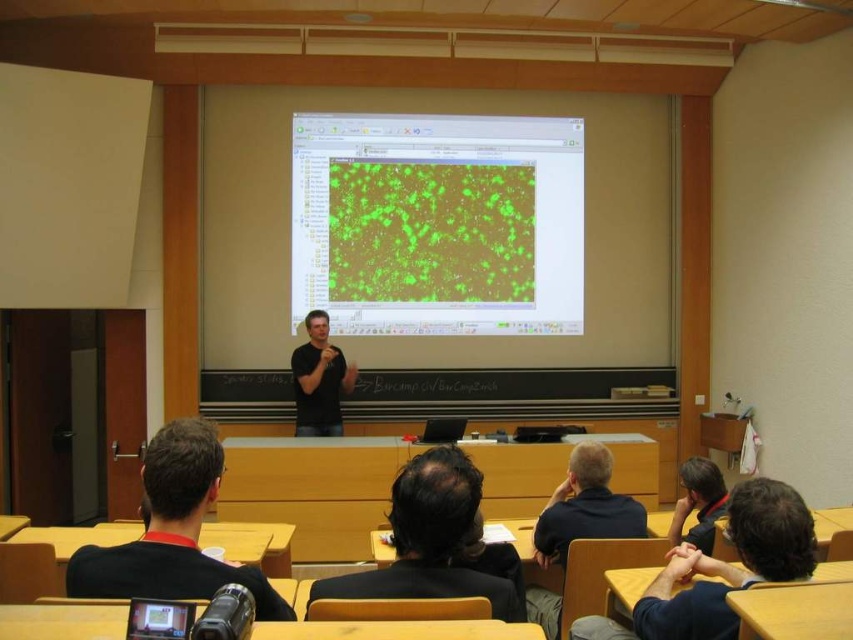
Who is positioned more to the right, black fabric shirt at lower left or black matte shirt at center?

black fabric shirt at lower left

The image size is (853, 640). Describe the element at coordinates (172, 531) in the screenshot. I see `black fabric shirt at lower left` at that location.

You are a GUI agent. You are given a task and a screenshot of the screen. Output one action in this format:
    pyautogui.click(x=<x>, y=<y>)
    Task: Click on the black fabric shirt at lower left
    The width and height of the screenshot is (853, 640).
    Given the screenshot: What is the action you would take?
    pyautogui.click(x=172, y=531)

Locate an element on the screen. green matte image at center is located at coordinates (438, 224).

Who is shorter, black fabric shirt at lower left or dark brown hair at center?

Standing shorter between the two is dark brown hair at center.

Can you confirm if black fabric shirt at lower left is wider than dark brown hair at center?

Correct, the width of black fabric shirt at lower left exceeds that of dark brown hair at center.

What do you see at coordinates (172, 531) in the screenshot? I see `black fabric shirt at lower left` at bounding box center [172, 531].

Locate an element on the screen. The width and height of the screenshot is (853, 640). black fabric shirt at lower left is located at coordinates (172, 531).